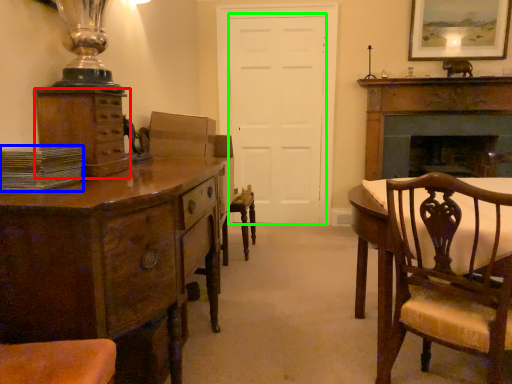
Question: Which object is positioned farthest from cabinetry (highlighted by a red box)? Select from book (highlighted by a blue box) and door (highlighted by a green box).

Choices:
 (A) book
 (B) door

Answer: (B)